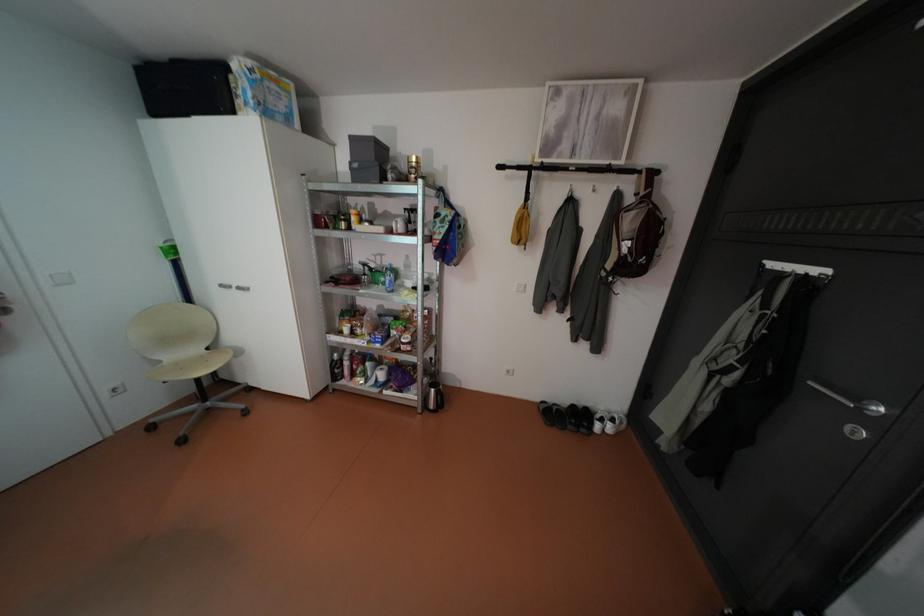
Where is `red backpack strap`? red backpack strap is located at coordinates [x=637, y=257].